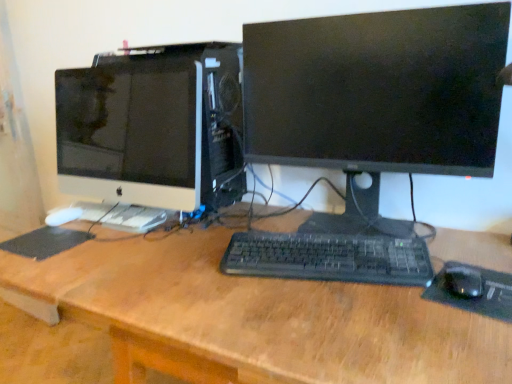
This screenshot has width=512, height=384. What are the coordinates of `free space that is in between black plastic keyboard at center and black matte mousepad at lower left, the 1th mousepad from the back` in the screenshot? It's located at (144, 248).